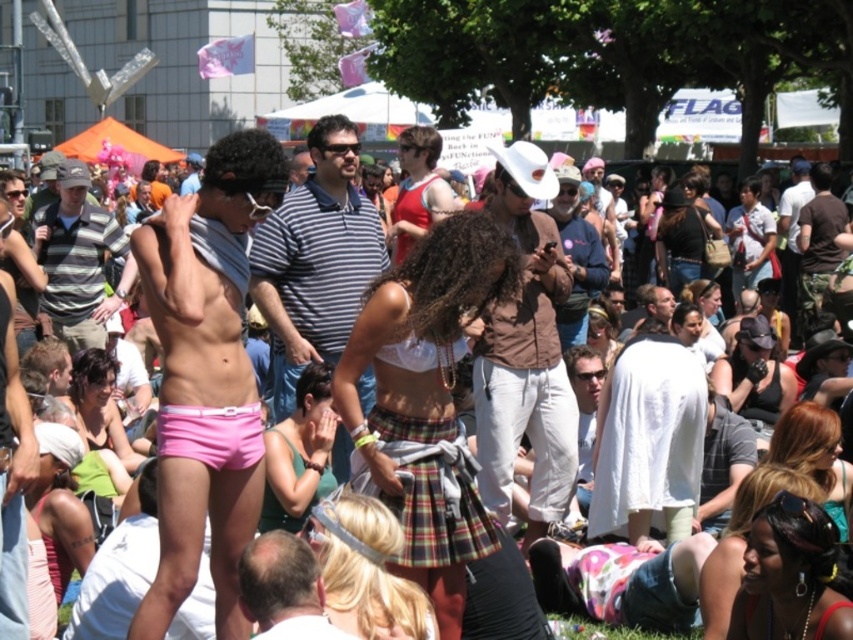
Question: Which point appears farthest from the camera in this image?

Choices:
 (A) (277, 589)
 (B) (824, 260)
 (C) (268, 506)

Answer: (B)

Question: Considering the relative positions of smooth skin head at center and brown leather jacket at center in the image provided, where is smooth skin head at center located with respect to brown leather jacket at center?

Choices:
 (A) right
 (B) left

Answer: (B)

Question: Is plaid fabric skirt at lower center closer to camera compared to smooth skin head at center?

Choices:
 (A) no
 (B) yes

Answer: (A)

Question: Does green matte tank top at center come in front of matte green tank top at lower left?

Choices:
 (A) yes
 (B) no

Answer: (A)

Question: Which point is closer to the camera taking this photo?

Choices:
 (A) (701, 237)
 (B) (786, 524)
 (C) (206, 456)
 (D) (444, 400)

Answer: (B)

Question: Which object is closer to the camera taking this photo?

Choices:
 (A) red fabric tank top at center
 (B) smooth skin head at center
 (C) brown leather jacket at center

Answer: (B)